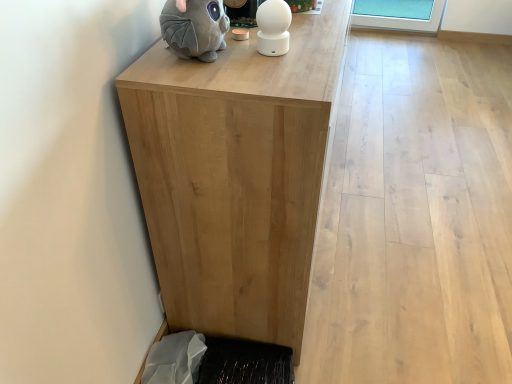
You are a GUI agent. You are given a task and a screenshot of the screen. Output one action in this format:
    pyautogui.click(x=<x>, y=<y>)
    Task: Click on the gray plush toy at upper left
    The image size is (512, 384).
    Given the screenshot: What is the action you would take?
    pyautogui.click(x=195, y=28)

Who is smaller, black textured mat at lower left or natural wood table at center?

black textured mat at lower left is smaller.

Considering the relative sizes of black textured mat at lower left and natural wood table at center in the image provided, is black textured mat at lower left wider than natural wood table at center?

No, black textured mat at lower left is not wider than natural wood table at center.

Is black textured mat at lower left taller or shorter than natural wood table at center?

black textured mat at lower left is shorter than natural wood table at center.

From the picture: Is natural wood table at center at the back of black textured mat at lower left?

No, black textured mat at lower left is not facing away from natural wood table at center.

Is black textured mat at lower left located within white glossy ball at upper center?

That's incorrect, black textured mat at lower left is not inside white glossy ball at upper center.

Is white glossy ball at upper center further to the viewer compared to black textured mat at lower left?

No.

From a real-world perspective, is white glossy ball at upper center physically below black textured mat at lower left?

No.

I want to click on doormat behind the white glossy ball at upper center, so click(x=245, y=362).

Which of these two, natural wood table at center or black textured mat at lower left, is bigger?

natural wood table at center.

Is black textured mat at lower left located within natural wood table at center?

No, black textured mat at lower left is located outside of natural wood table at center.

From the picture: Could you tell me if natural wood table at center is facing black textured mat at lower left?

No.

Based on the photo, can you confirm if natural wood table at center is taller than black textured mat at lower left?

Yes, natural wood table at center is taller than black textured mat at lower left.

Can you confirm if white glossy ball at upper center is taller than natural wood table at center?

Incorrect, the height of white glossy ball at upper center is not larger of that of natural wood table at center.

From a real-world perspective, which is physically below, white glossy ball at upper center or natural wood table at center?

From a 3D spatial view, natural wood table at center is below.

Looking at this image, is white glossy ball at upper center in front of or behind natural wood table at center in the image?

white glossy ball at upper center is positioned farther from the viewer than natural wood table at center.

Considering the relative positions of black textured mat at lower left and gray plush toy at upper left in the image provided, is black textured mat at lower left to the left or to the right of gray plush toy at upper left?

black textured mat at lower left is to the right of gray plush toy at upper left.

Which object is thinner, black textured mat at lower left or gray plush toy at upper left?

gray plush toy at upper left is thinner.

Consider the image. From the image's perspective, who appears lower, black textured mat at lower left or gray plush toy at upper left?

black textured mat at lower left, from the image's perspective.

This screenshot has width=512, height=384. I want to click on doormat below the gray plush toy at upper left (from the image's perspective), so click(245, 362).

Is gray plush toy at upper left aimed at black textured mat at lower left?

No, gray plush toy at upper left is not turned towards black textured mat at lower left.

Do you think gray plush toy at upper left is within black textured mat at lower left, or outside of it?

gray plush toy at upper left cannot be found inside black textured mat at lower left.

From the image's perspective, which one is positioned lower, gray plush toy at upper left or black textured mat at lower left?

black textured mat at lower left.

From the image's perspective, between gray plush toy at upper left and white glossy ball at upper center, who is located below?

white glossy ball at upper center is shown below in the image.

The height and width of the screenshot is (384, 512). What are the coordinates of `toy on the left of white glossy ball at upper center` in the screenshot? It's located at (x=195, y=28).

Is gray plush toy at upper left aimed at white glossy ball at upper center?

Yes, gray plush toy at upper left is aimed at white glossy ball at upper center.

Can you see gray plush toy at upper left touching white glossy ball at upper center?

No.

Locate an element on the screen. Image resolution: width=512 pixels, height=384 pixels. doormat below the natural wood table at center (from a real-world perspective) is located at coordinates (245, 362).

Find the location of `doormat behind the white glossy ball at upper center`. doormat behind the white glossy ball at upper center is located at coordinates (245, 362).

Considering their positions, is natural wood table at center positioned further to black textured mat at lower left than white glossy ball at upper center?

The object further to black textured mat at lower left is white glossy ball at upper center.

Which object lies further to the anchor point gray plush toy at upper left, natural wood table at center or black textured mat at lower left?

black textured mat at lower left lies further to gray plush toy at upper left than the other object.

Which object lies further to the anchor point black textured mat at lower left, white glossy ball at upper center or natural wood table at center?

white glossy ball at upper center is further to black textured mat at lower left.

Looking at the image, which one is located closer to gray plush toy at upper left, white glossy ball at upper center or natural wood table at center?

The object closer to gray plush toy at upper left is white glossy ball at upper center.

Which object lies nearer to the anchor point black textured mat at lower left, gray plush toy at upper left or white glossy ball at upper center?

white glossy ball at upper center is positioned closer to the anchor black textured mat at lower left.

Considering their positions, is white glossy ball at upper center positioned further to black textured mat at lower left than gray plush toy at upper left?

gray plush toy at upper left lies further to black textured mat at lower left than the other object.

Which object lies further to the anchor point white glossy ball at upper center, natural wood table at center or black textured mat at lower left?

Based on the image, black textured mat at lower left appears to be further to white glossy ball at upper center.

Which object lies nearer to the anchor point gray plush toy at upper left, natural wood table at center or white glossy ball at upper center?

white glossy ball at upper center.

The image size is (512, 384). What are the coordinates of `table between gray plush toy at upper left and black textured mat at lower left vertically` in the screenshot? It's located at (236, 176).

I want to click on figurine that lies between gray plush toy at upper left and black textured mat at lower left from top to bottom, so click(x=273, y=27).

The width and height of the screenshot is (512, 384). I want to click on table between white glossy ball at upper center and black textured mat at lower left from top to bottom, so click(236, 176).

Find the location of a particular element. Image resolution: width=512 pixels, height=384 pixels. figurine between gray plush toy at upper left and natural wood table at center from left to right is located at coordinates (273, 27).